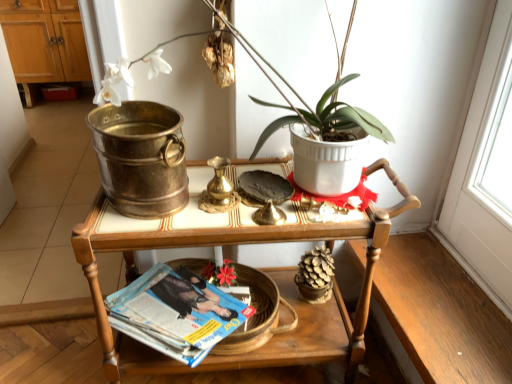
Describe the element at coordinates (176, 313) in the screenshot. I see `blue glossy magazine at lower center` at that location.

Where is `brushed metal bucket at upper left`? The image size is (512, 384). brushed metal bucket at upper left is located at coordinates (44, 42).

The height and width of the screenshot is (384, 512). Identify the location of blue glossy magazine at lower center. (176, 313).

From the image's perspective, who appears lower, blue glossy magazine at lower center or white ceramic pot at upper center?

blue glossy magazine at lower center, from the image's perspective.

Which is more to the left, blue glossy magazine at lower center or white ceramic pot at upper center?

blue glossy magazine at lower center.

Where is `houseplant positioned vertically above the blue glossy magazine at lower center (from a real-world perspective)`? This screenshot has height=384, width=512. houseplant positioned vertically above the blue glossy magazine at lower center (from a real-world perspective) is located at coordinates (371, 125).

Considering the positions of objects blue glossy magazine at lower center and white ceramic pot at upper center in the image provided, who is in front, blue glossy magazine at lower center or white ceramic pot at upper center?

Positioned in front is white ceramic pot at upper center.

Who is bigger, white ceramic pot at upper center or wooden tray at center?

wooden tray at center.

Is white ceramic pot at upper center turned away from wooden tray at center?

white ceramic pot at upper center does not have its back to wooden tray at center.

Who is taller, white ceramic pot at upper center or wooden tray at center?

wooden tray at center is taller.

Is white ceramic pot at upper center far from wooden tray at center?

No, white ceramic pot at upper center is in close proximity to wooden tray at center.

Who is shorter, blue glossy magazine at lower center or wooden tray at center?

blue glossy magazine at lower center.

Looking at the image, does blue glossy magazine at lower center seem bigger or smaller compared to wooden tray at center?

Considering their sizes, blue glossy magazine at lower center takes up less space than wooden tray at center.

Looking at this image, is blue glossy magazine at lower center situated inside wooden tray at center or outside?

blue glossy magazine at lower center is inside wooden tray at center.

How many degrees apart are the facing directions of blue glossy magazine at lower center and wooden tray at center?

0.687 degrees.

Is wooden tray at center taller or shorter than blue glossy magazine at lower center?

Clearly, wooden tray at center is taller compared to blue glossy magazine at lower center.

Visually, is wooden tray at center positioned to the left or to the right of blue glossy magazine at lower center?

Based on their positions, wooden tray at center is located to the right of blue glossy magazine at lower center.

Based on the photo, how many degrees apart are the facing directions of wooden tray at center and blue glossy magazine at lower center?

The angular difference between wooden tray at center and blue glossy magazine at lower center is 0.687 degrees.

From a real-world perspective, between wooden tray at center and blue glossy magazine at lower center, who is vertically higher?

In real-world perspective, wooden tray at center is above.

Between wooden tray at center and white ceramic pot at upper center, which one has larger size?

Bigger between the two is wooden tray at center.

Is wooden tray at center in contact with white ceramic pot at upper center?

No, wooden tray at center is not touching white ceramic pot at upper center.

At what (x,y) coordinates should I click in order to perform the action: click on houseplant that appears above the wooden tray at center (from the image's perspective). Please return your answer as a coordinate pair (x, y). Looking at the image, I should click on 371,125.

Is wooden tray at center not within white ceramic pot at upper center?

That's correct, wooden tray at center is outside of white ceramic pot at upper center.

Is white ceramic pot at upper center oriented away from brushed metal bucket at upper left?

Yes, brushed metal bucket at upper left is at the back of white ceramic pot at upper center.

Looking at this image, which is nearer, (111, 19) or (86, 64)?

Positioned in front is point (111, 19).

Looking at this image, considering the sizes of objects white ceramic pot at upper center and brushed metal bucket at upper left in the image provided, who is taller, white ceramic pot at upper center or brushed metal bucket at upper left?

Standing taller between the two is brushed metal bucket at upper left.

Which object is further away from the camera, white ceramic pot at upper center or brushed metal bucket at upper left?

brushed metal bucket at upper left.

From a real-world perspective, relative to brushed metal bucket at upper left, is wooden tray at center vertically above or below?

In terms of real-world spatial position, wooden tray at center is below brushed metal bucket at upper left.

From the image's perspective, is wooden tray at center over brushed metal bucket at upper left?

No, from the image's perspective, wooden tray at center is not above brushed metal bucket at upper left.

From the picture: Is wooden tray at center with brushed metal bucket at upper left?

No, wooden tray at center is not making contact with brushed metal bucket at upper left.

This screenshot has height=384, width=512. Identify the location of magazine on the left of white ceramic pot at upper center. (176, 313).

At what (x,y) coordinates should I click in order to perform the action: click on houseplant in front of the wooden tray at center. Please return your answer as a coordinate pair (x, y). The height and width of the screenshot is (384, 512). Looking at the image, I should click on (371, 125).

Which object lies nearer to the anchor point white ceramic pot at upper center, blue glossy magazine at lower center or wooden tray at center?

wooden tray at center.

Based on their spatial positions, is blue glossy magazine at lower center or white ceramic pot at upper center further from wooden tray at center?

white ceramic pot at upper center.

From the image, which object appears to be farther from blue glossy magazine at lower center, brushed metal bucket at upper left or white ceramic pot at upper center?

brushed metal bucket at upper left is further to blue glossy magazine at lower center.

Which object lies further to the anchor point brushed metal bucket at upper left, wooden tray at center or blue glossy magazine at lower center?

wooden tray at center.

Estimate the real-world distances between objects in this image. Which object is closer to wooden tray at center, brushed metal bucket at upper left or white ceramic pot at upper center?

white ceramic pot at upper center lies closer to wooden tray at center than the other object.

Considering their positions, is wooden tray at center positioned closer to blue glossy magazine at lower center than brushed metal bucket at upper left?

Based on the image, wooden tray at center appears to be nearer to blue glossy magazine at lower center.

From the image, which object appears to be farther from wooden tray at center, brushed metal bucket at upper left or blue glossy magazine at lower center?

Based on the image, brushed metal bucket at upper left appears to be further to wooden tray at center.

In the scene shown: Based on their spatial positions, is wooden tray at center or white ceramic pot at upper center closer to blue glossy magazine at lower center?

wooden tray at center lies closer to blue glossy magazine at lower center than the other object.

I want to click on table between white ceramic pot at upper center and blue glossy magazine at lower center from top to bottom, so click(283, 295).

Image resolution: width=512 pixels, height=384 pixels. What are the coordinates of `table between white ceramic pot at upper center and brushed metal bucket at upper left in the front-back direction` in the screenshot? It's located at (283, 295).

This screenshot has width=512, height=384. I want to click on magazine between wooden tray at center and brushed metal bucket at upper left in the front-back direction, so click(x=176, y=313).

What are the coordinates of `magazine positioned between white ceramic pot at upper center and brushed metal bucket at upper left from near to far` in the screenshot? It's located at (176, 313).